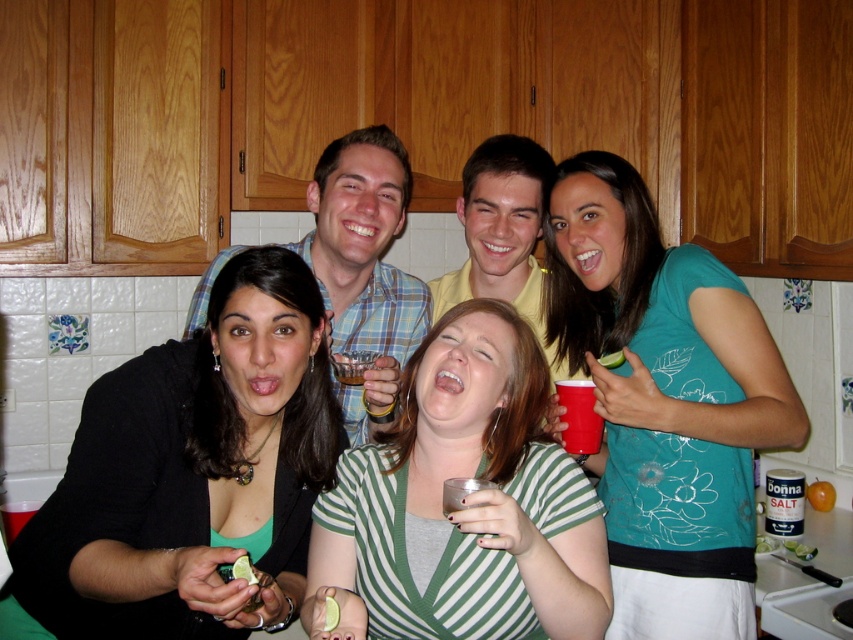
Question: Which object appears closest to the camera in this image?

Choices:
 (A) yellow cotton shirt at center
 (B) green printed shirt at upper right

Answer: (B)

Question: Is green printed shirt at upper right positioned at the back of plaid shirt at center?

Choices:
 (A) no
 (B) yes

Answer: (A)

Question: Which of these objects is positioned farthest from the green printed shirt at upper right?

Choices:
 (A) yellow cotton shirt at center
 (B) green striped shirt at center

Answer: (B)

Question: Is green striped shirt at center positioned at the back of yellow cotton shirt at center?

Choices:
 (A) no
 (B) yes

Answer: (A)

Question: Does green printed shirt at upper right appear under yellow cotton shirt at center?

Choices:
 (A) yes
 (B) no

Answer: (A)

Question: Which object appears farthest from the camera in this image?

Choices:
 (A) yellow cotton shirt at center
 (B) green striped shirt at center
 (C) green printed shirt at upper right
 (D) matte plastic cup at center

Answer: (A)